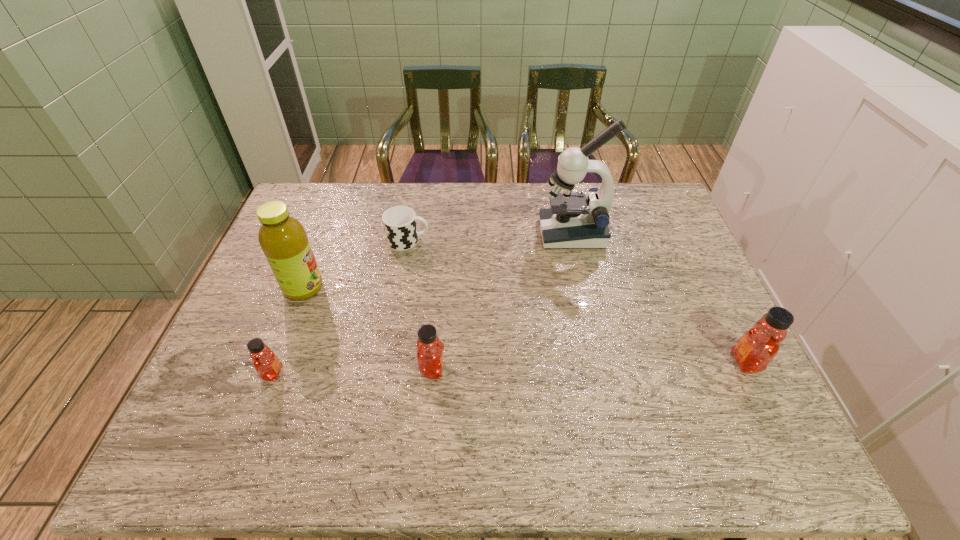
I want to click on the second shortest object, so coord(266,363).

At what (x,y) coordinates should I click in order to perform the action: click on the leftmost honey. Please return your answer as a coordinate pair (x, y). This screenshot has height=540, width=960. Looking at the image, I should click on click(266, 363).

What are the coordinates of `the second shortest honey` in the screenshot? It's located at (430, 359).

Identify the location of the second honey from right to left. (430, 359).

At what (x,y) coordinates should I click in order to perform the action: click on the tallest honey. Please return your answer as a coordinate pair (x, y). The width and height of the screenshot is (960, 540). Looking at the image, I should click on (755, 349).

Identify the location of the rightmost object. (755, 349).

The height and width of the screenshot is (540, 960). What are the coordinates of `the third object from left to right` in the screenshot? It's located at (399, 222).

Image resolution: width=960 pixels, height=540 pixels. Find the location of `cup`. cup is located at coordinates (399, 222).

At what (x,y) coordinates should I click in order to perform the action: click on the third farthest object. Please return your answer as a coordinate pair (x, y). The image size is (960, 540). Looking at the image, I should click on (283, 239).

The height and width of the screenshot is (540, 960). Find the location of `the second tallest object`. the second tallest object is located at coordinates (283, 239).